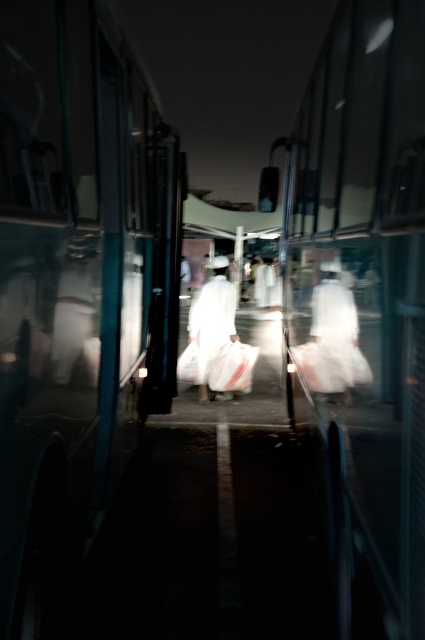
Based on the photo, you are a passenger on the bus and you see two points through the window. The first point is at coordinate point (371, 230) and the second is at point (319, 342). From your perspective inside the bus, which point is closer to the bus?

Point (371, 230) is in front of point (319, 342), so it is closer to the bus.

You are a passenger on the bus and want to know what is located at the specific point marked as point [362,305] in the image. What object is there?

The shiny metallic bus at center is located at point [362,305].

You are a passenger sitting in the bus and want to ask the person in the white matte robe at center for directions. Can you comfortably reach them from your seat without leaving your seat?

The white matte robe at center is 1.67 meters away from the camera, so you can comfortably reach them from your seat without leaving your seat.